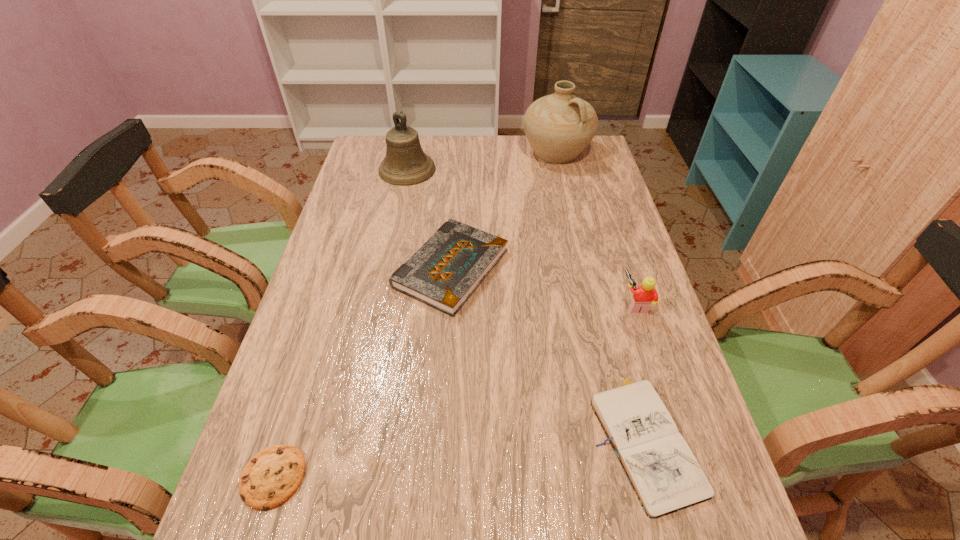
This screenshot has width=960, height=540. I want to click on pottery that is at the right edge, so click(x=559, y=126).

Where is `Lego present at the right edge`? The width and height of the screenshot is (960, 540). Lego present at the right edge is located at coordinates (645, 294).

Identify the location of notebook present at the right edge. (664, 473).

Where is `object that is at the far left corner`? The height and width of the screenshot is (540, 960). object that is at the far left corner is located at coordinates (405, 163).

The width and height of the screenshot is (960, 540). What are the coordinates of `object present at the far right corner` in the screenshot? It's located at (559, 126).

Where is `free spot at the far edge of the desktop`? free spot at the far edge of the desktop is located at coordinates (487, 142).

Image resolution: width=960 pixels, height=540 pixels. I want to click on vacant area at the right edge of the desktop, so click(630, 245).

Locate an element on the screen. free location at the far left corner is located at coordinates (372, 140).

You are a GUI agent. You are given a task and a screenshot of the screen. Output one action in this format:
    pyautogui.click(x=<x>, y=<y>)
    Task: Click on the free spot between the Lego and the cookie
    Image resolution: width=960 pixels, height=540 pixels.
    Given the screenshot: What is the action you would take?
    pyautogui.click(x=454, y=390)

Where is `unoccupied position between the nearer notebook and the pottery`? unoccupied position between the nearer notebook and the pottery is located at coordinates (600, 295).